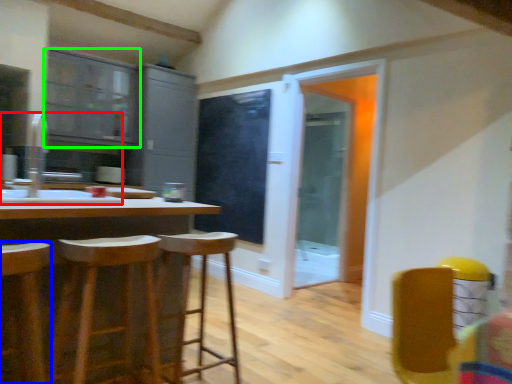
Question: Which object is positioned closest to sink (highlighted by a red box)? Select from stool (highlighted by a blue box) and cabinetry (highlighted by a green box).

Choices:
 (A) stool
 (B) cabinetry

Answer: (B)